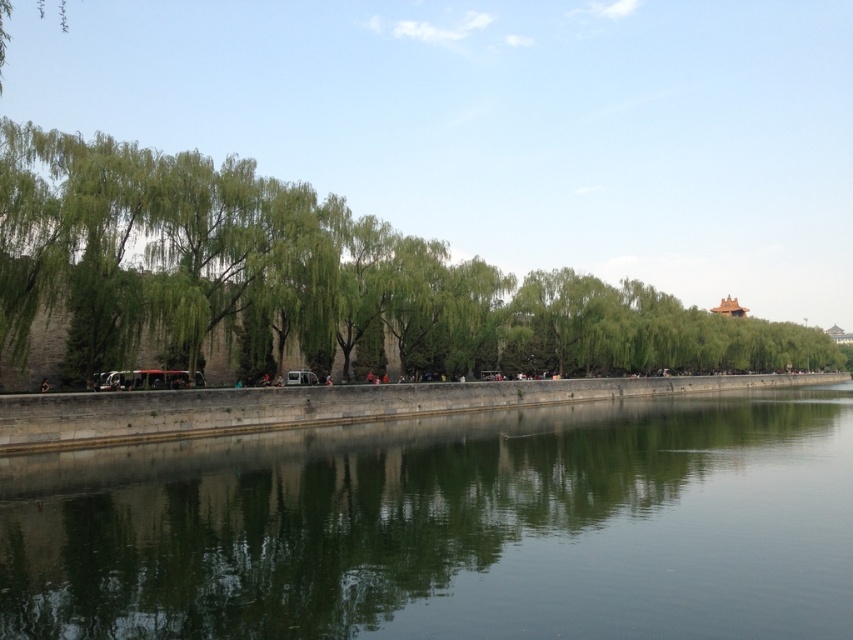
Question: Does green stone wall at lower center come in front of green leafy tree at left?

Choices:
 (A) yes
 (B) no

Answer: (A)

Question: In this image, where is green stone wall at lower center located relative to green leafy tree at left?

Choices:
 (A) below
 (B) above

Answer: (A)

Question: Which point appears closest to the camera in this image?

Choices:
 (A) (209, 572)
 (B) (502, 320)

Answer: (A)

Question: Is green stone wall at lower center to the right of green leafy tree at left from the viewer's perspective?

Choices:
 (A) no
 (B) yes

Answer: (A)